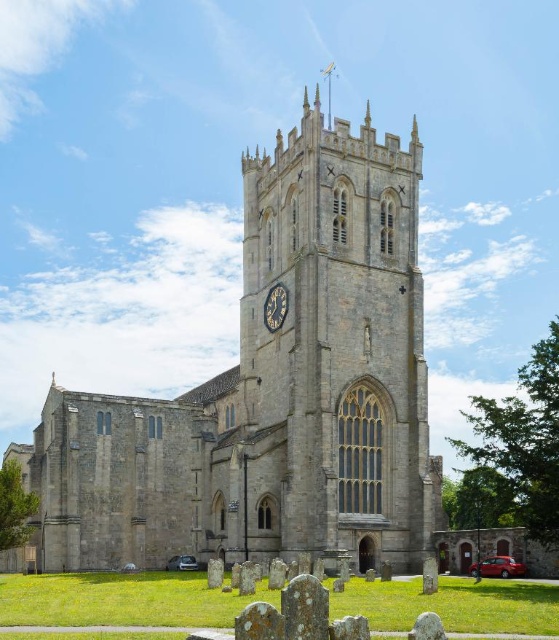
Can you confirm if gray stone church at center is shorter than stone clock tower at center?

Incorrect, gray stone church at center's height does not fall short of stone clock tower at center's.

Between gray stone church at center and stone clock tower at center, which one appears on the right side from the viewer's perspective?

stone clock tower at center is more to the right.

Where is `gray stone church at center`? This screenshot has height=640, width=559. gray stone church at center is located at coordinates (271, 392).

Is gray stone church at center taller than dark blue stone clock at center?

Correct, gray stone church at center is much taller as dark blue stone clock at center.

Is gray stone church at center below dark blue stone clock at center?

Yes, gray stone church at center is below dark blue stone clock at center.

Is point (101, 531) in front of point (276, 308)?

That is True.

At what (x,y) coordinates should I click in order to perform the action: click on gray stone church at center. Please return your answer as a coordinate pair (x, y). Image resolution: width=559 pixels, height=640 pixels. Looking at the image, I should click on (271, 392).

Who is more distant from viewer, (282, 257) or (269, 300)?

Point (269, 300)

Is stone clock tower at center bigger than dark blue stone clock at center?

Yes, stone clock tower at center is bigger than dark blue stone clock at center.

Who is more forward, [309,522] or [272,326]?

Point [309,522] is more forward.

This screenshot has width=559, height=640. I want to click on stone clock tower at center, so click(x=333, y=352).